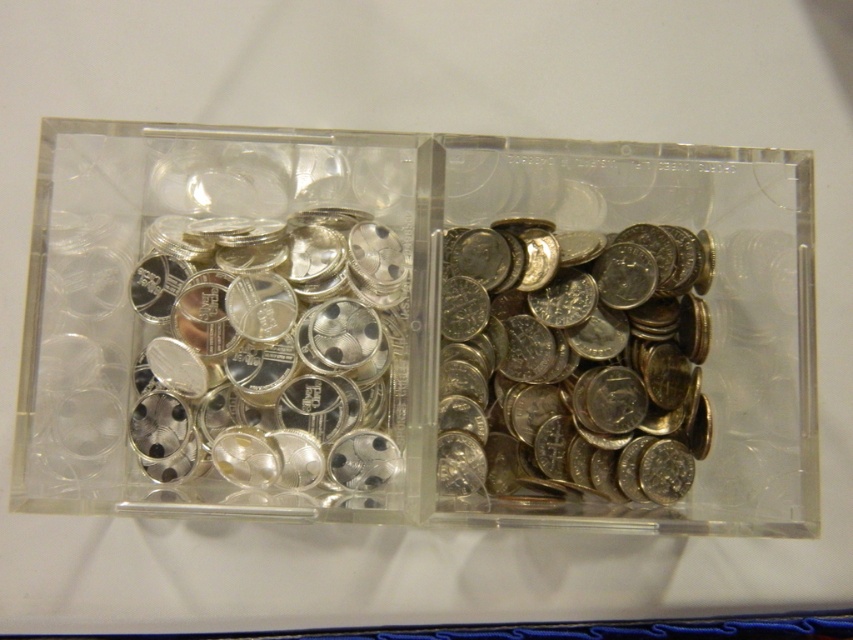
Question: Which object appears farthest from the camera in this image?

Choices:
 (A) silver shiny coins at center
 (B) transparent plastic coins at center
 (C) shiny metallic coins at center

Answer: (C)

Question: Where is shiny metallic coins at center located in relation to silver shiny coins at center in the image?

Choices:
 (A) left
 (B) right

Answer: (B)

Question: From the image, what is the correct spatial relationship of transparent plastic coins at center in relation to silver shiny coins at center?

Choices:
 (A) above
 (B) below

Answer: (A)

Question: Does shiny metallic coins at center lie behind silver shiny coins at center?

Choices:
 (A) yes
 (B) no

Answer: (A)

Question: Which point appears farthest from the camera in this image?

Choices:
 (A) (519, 413)
 (B) (535, 157)

Answer: (A)

Question: Estimate the real-world distances between objects in this image. Which object is farther from the silver shiny coins at center?

Choices:
 (A) transparent plastic coins at center
 (B) shiny metallic coins at center

Answer: (B)